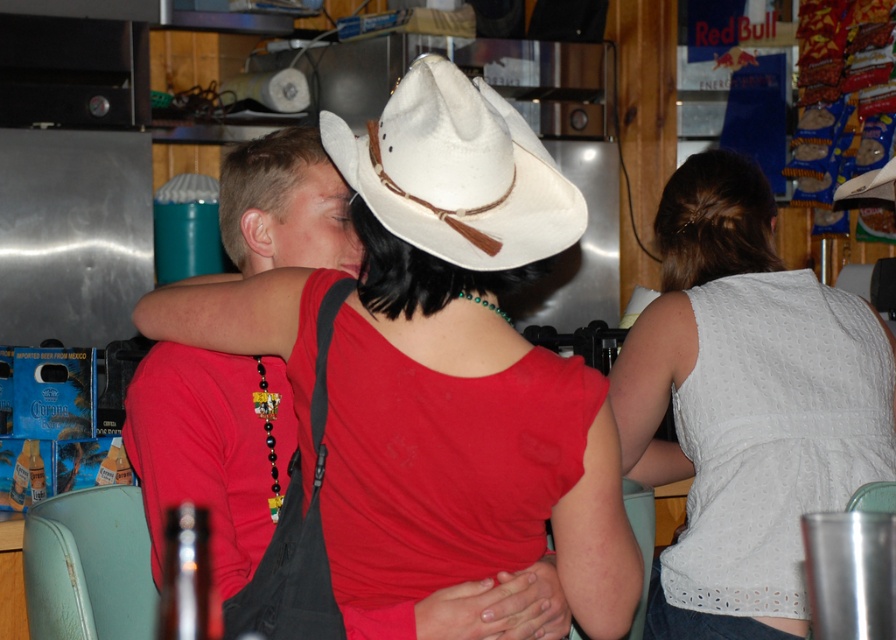
Question: Is white lace tank top at center above matte black shirt at center?

Choices:
 (A) no
 (B) yes

Answer: (A)

Question: Which point is farther to the camera?

Choices:
 (A) white felt cowboy hat at center
 (B) white lace tank top at center

Answer: (B)

Question: Where is white lace tank top at center located in relation to matte black shirt at center in the image?

Choices:
 (A) above
 (B) below

Answer: (B)

Question: Which of the following is the farthest from the observer?

Choices:
 (A) (395, 620)
 (B) (701, 372)
 (C) (420, 220)

Answer: (B)

Question: Does matte black shirt at center have a larger size compared to white felt cowboy hat at center?

Choices:
 (A) yes
 (B) no

Answer: (A)

Question: Which of the following is the closest to the observer?

Choices:
 (A) (492, 170)
 (B) (754, 172)
 (C) (238, 436)

Answer: (A)